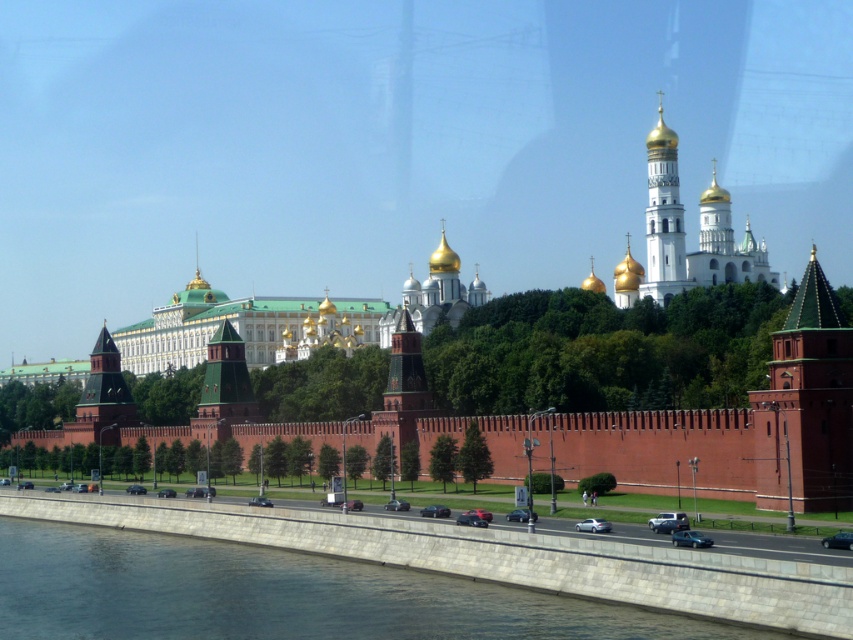
Question: Which object appears farthest from the camera in this image?

Choices:
 (A) white stone tower at upper center
 (B) green wooden tower at center
 (C) green stone tower at left

Answer: (A)

Question: Where is brick tower at right located in relation to green stone tower at left in the image?

Choices:
 (A) above
 (B) below

Answer: (A)

Question: Among these points, which one is farthest from the camera?

Choices:
 (A) (97, 362)
 (B) (811, 483)
 (C) (646, 138)
 (D) (252, 394)

Answer: (C)

Question: Does brick tower at right have a greater width compared to green wooden tower at center?

Choices:
 (A) no
 (B) yes

Answer: (A)

Question: Considering the real-world distances, which object is farthest from the gray concrete river at lower left?

Choices:
 (A) green stone tower at left
 (B) white stone tower at upper center

Answer: (B)

Question: Is gray concrete river at lower left bigger than green stone tower at left?

Choices:
 (A) yes
 (B) no

Answer: (A)